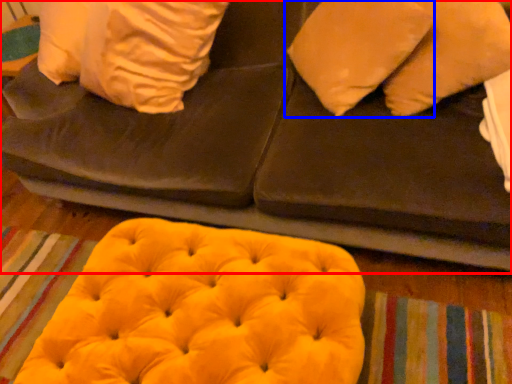
Question: Among these objects, which one is farthest to the camera, furniture (highlighted by a red box) or pillow (highlighted by a blue box)?

Choices:
 (A) furniture
 (B) pillow

Answer: (B)